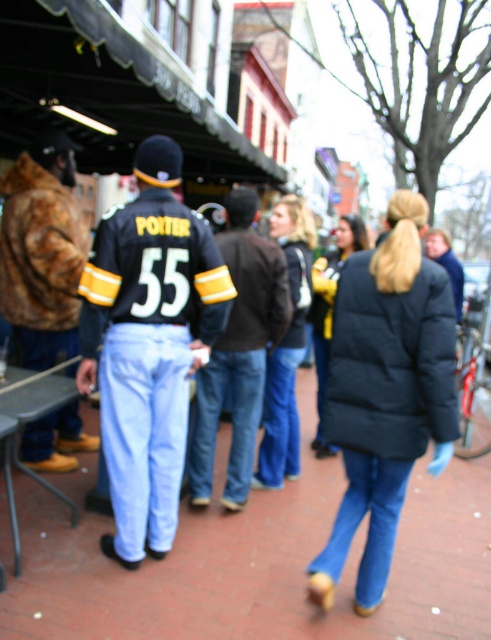
You are a photographer trying to capture a candid shot of the person wearing the black jersey at center without including their blue jeans at center in the frame. Based on their positions, is this possible?

The blue jeans at center are to the right of the black jersey at center, so if you position your camera to the left side of the black jersey at center, you can capture the jersey without including the blue jeans at center in the shot.

You are a photographer trying to capture a clear shot of the fur coat at left and the metallic silver picnic table at lower left. Which object should you focus on first if you want to keep both in focus without adjusting your camera settings?

The metallic silver picnic table at lower left is behind the fur coat at left, so you should focus on the fur coat at left first to ensure both are in focus.